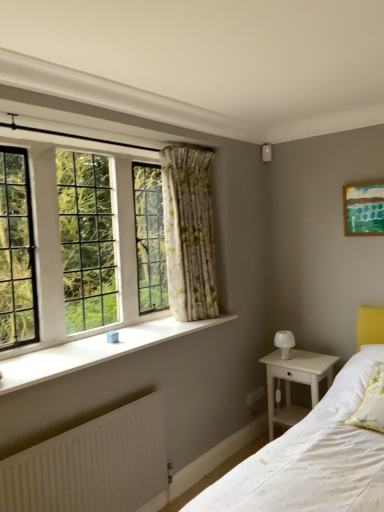
The height and width of the screenshot is (512, 384). What do you see at coordinates (371, 402) in the screenshot? I see `white soft pillow at lower right` at bounding box center [371, 402].

At what (x,y) coordinates should I click in order to perform the action: click on white smooth window sill at lower left. Please return your answer as a coordinate pair (x, y). Image resolution: width=384 pixels, height=512 pixels. Looking at the image, I should click on coord(93,351).

Measure the distance between white wood nightstand at lower right and camera.

white wood nightstand at lower right and camera are 2.84 meters apart from each other.

Measure the distance between point [92,222] and camera.

Point [92,222] and camera are 8.62 feet apart from each other.

This screenshot has width=384, height=512. I want to click on white soft pillow at lower right, so click(371, 402).

In the image, there is a white smooth window sill at lower left. Identify the location of radiator below it (from the image's perspective). The image size is (384, 512). (92, 464).

Could you tell me if white textured radiator at lower left is facing white smooth window sill at lower left?

No, white textured radiator at lower left does not turn towards white smooth window sill at lower left.

Which object is further away from the camera taking this photo, white textured radiator at lower left or white smooth window sill at lower left?

white smooth window sill at lower left is further from the camera.

From a real-world perspective, which object rests below the other?

white soft pillow at lower right is physically lower.

Which is more to the right, green textured canvas at upper right or white soft pillow at lower right?

green textured canvas at upper right is more to the right.

Considering the sizes of objects green textured canvas at upper right and white soft pillow at lower right in the image provided, who is shorter, green textured canvas at upper right or white soft pillow at lower right?

Standing shorter between the two is white soft pillow at lower right.

Can you confirm if white wood nightstand at lower right is shorter than white soft pillow at lower right?

No.

Is white wood nightstand at lower right completely or partially outside of white soft pillow at lower right?

That's correct, white wood nightstand at lower right is outside of white soft pillow at lower right.

From the picture: From a real-world perspective, which object stands above the other?

white soft pillow at lower right, from a real-world perspective.

Is clear glass windows at upper left inside white textured radiator at lower left?

No, white textured radiator at lower left does not contain clear glass windows at upper left.

Is point (3, 501) positioned behind point (71, 244)?

No, it is in front of (71, 244).

Is white textured radiator at lower left looking in the opposite direction of clear glass windows at upper left?

No, white textured radiator at lower left is not facing away from clear glass windows at upper left.

Considering the points (372, 224) and (141, 175), which point is behind, point (372, 224) or point (141, 175)?

The point (372, 224) is farther from the camera.

Is green textured canvas at upper right turned away from clear glass windows at upper left?

That's not correct — green textured canvas at upper right is not looking away from clear glass windows at upper left.

Would you say green textured canvas at upper right is outside clear glass windows at upper left?

green textured canvas at upper right lies outside clear glass windows at upper left's area.

Is green textured canvas at upper right to the right of clear glass windows at upper left from the viewer's perspective?

Indeed, green textured canvas at upper right is positioned on the right side of clear glass windows at upper left.

Is floral fabric curtain at center wider or thinner than white wood nightstand at lower right?

floral fabric curtain at center is thinner than white wood nightstand at lower right.

Is floral fabric curtain at center in front of or behind white wood nightstand at lower right in the image?

floral fabric curtain at center is in front of white wood nightstand at lower right.

Is white textured radiator at lower left looking in the opposite direction of green textured canvas at upper right?

No.

Where is `radiator lying on the left of green textured canvas at upper right`? Image resolution: width=384 pixels, height=512 pixels. radiator lying on the left of green textured canvas at upper right is located at coordinates (92, 464).

What's the angular difference between white textured radiator at lower left and green textured canvas at upper right's facing directions?

The angular difference between white textured radiator at lower left and green textured canvas at upper right is 89.8 degrees.

Locate an element on the screen. The height and width of the screenshot is (512, 384). radiator below the white smooth window sill at lower left (from a real-world perspective) is located at coordinates (92, 464).

Find the location of a particular element. picture frame above the white soft pillow at lower right (from the image's perspective) is located at coordinates (364, 208).

Considering their positions, is white wood nightstand at lower right positioned further to clear glass windows at upper left than white smooth window sill at lower left?

Among the two, white wood nightstand at lower right is located further to clear glass windows at upper left.

Which object lies nearer to the anchor point floral fabric curtain at center, clear glass windows at upper left or white wood nightstand at lower right?

Answer: clear glass windows at upper left.

Based on the photo, based on their spatial positions, is white smooth window sill at lower left or white wood nightstand at lower right closer to green textured canvas at upper right?

Among the two, white wood nightstand at lower right is located nearer to green textured canvas at upper right.

Estimate the real-world distances between objects in this image. Which object is closer to clear glass windows at upper left, white soft pillow at lower right or green textured canvas at upper right?

Among the two, green textured canvas at upper right is located nearer to clear glass windows at upper left.

Based on their spatial positions, is clear glass windows at upper left or white soft pillow at lower right closer to floral fabric curtain at center?

clear glass windows at upper left is positioned closer to the anchor floral fabric curtain at center.

Looking at the image, which one is located further to white textured radiator at lower left, white soft pillow at lower right or clear glass windows at upper left?

Based on the image, white soft pillow at lower right appears to be further to white textured radiator at lower left.

Considering their positions, is floral fabric curtain at center positioned further to white smooth window sill at lower left than white soft pillow at lower right?

white soft pillow at lower right.

Based on their spatial positions, is floral fabric curtain at center or white smooth window sill at lower left further from clear glass windows at upper left?

white smooth window sill at lower left lies further to clear glass windows at upper left than the other object.

Find the location of a particular element. This screenshot has height=512, width=384. nightstand between white smooth window sill at lower left and green textured canvas at upper right is located at coordinates (295, 382).

Find the location of a particular element. Image resolution: width=384 pixels, height=512 pixels. window sill between white textured radiator at lower left and white wood nightstand at lower right from left to right is located at coordinates (93, 351).

Locate an element on the screen. The image size is (384, 512). nightstand situated between clear glass windows at upper left and green textured canvas at upper right from left to right is located at coordinates (295, 382).

Locate an element on the screen. The image size is (384, 512). pillow between white smooth window sill at lower left and green textured canvas at upper right from left to right is located at coordinates (371, 402).